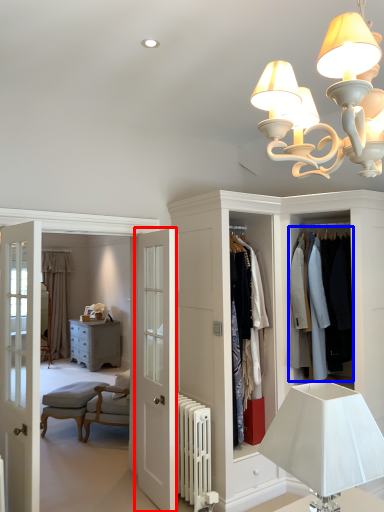
Question: Which of the following is the closest to the observer, door (highlighted by a red box) or clothing (highlighted by a blue box)?

Choices:
 (A) door
 (B) clothing

Answer: (A)